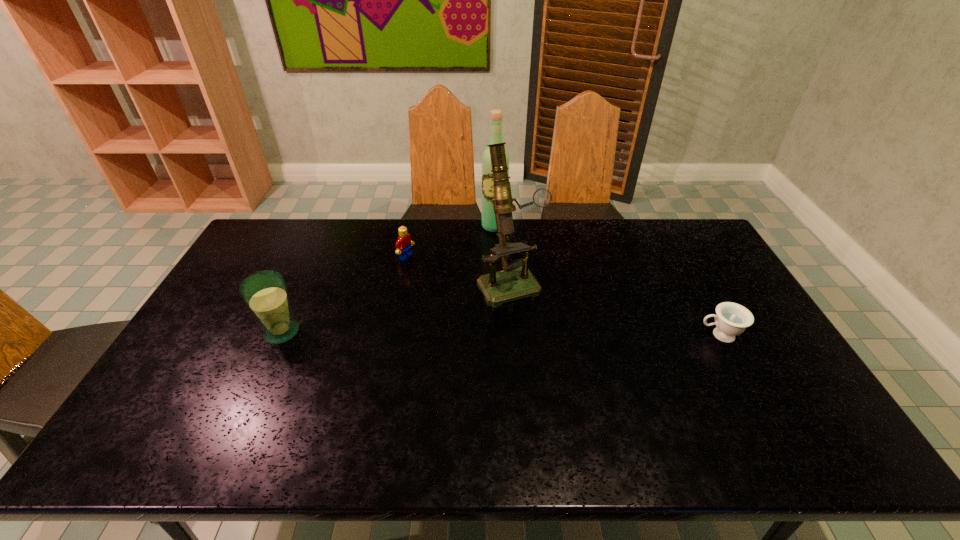
Locate an element on the screen. free spot between the wine bottle and the second shortest object is located at coordinates (450, 241).

Where is `vacant space that is in between the fourth tallest object and the microscope`? Image resolution: width=960 pixels, height=540 pixels. vacant space that is in between the fourth tallest object and the microscope is located at coordinates (458, 269).

Find the location of `free spot between the third tallest object and the second shortest object`. free spot between the third tallest object and the second shortest object is located at coordinates (344, 294).

You are a GUI agent. You are given a task and a screenshot of the screen. Output one action in this format:
    pyautogui.click(x=<x>, y=<y>)
    Task: Click on the vacant region between the microscope and the teacup
    
    Given the screenshot: What is the action you would take?
    pyautogui.click(x=614, y=308)

Where is `free point between the second object from left to right and the glass`? The width and height of the screenshot is (960, 540). free point between the second object from left to right and the glass is located at coordinates (344, 294).

Locate an element on the screen. free space between the shortest object and the farthest object is located at coordinates (607, 281).

Identify the location of blank region between the wine bottle and the fourth tallest object. (450, 241).

Where is `object identified as the fourth closest to the rightmost object`? The height and width of the screenshot is (540, 960). object identified as the fourth closest to the rightmost object is located at coordinates (265, 293).

Point out which object is positioned as the fourth nearest to the Lego. Please provide its 2D coordinates. Your answer should be formatted as a tuple, i.e. [(x, y)], where the tuple contains the x and y coordinates of a point satisfying the conditions above.

[(731, 319)]

You are a GUI agent. You are given a task and a screenshot of the screen. Output one action in this format:
    pyautogui.click(x=<x>, y=<y>)
    Task: Click on the vacant point that satisfies the following two spatial constraints: 1. on the back side of the farthest object; 2. on the right side of the second shortest object
    
    Given the screenshot: What is the action you would take?
    pyautogui.click(x=413, y=226)